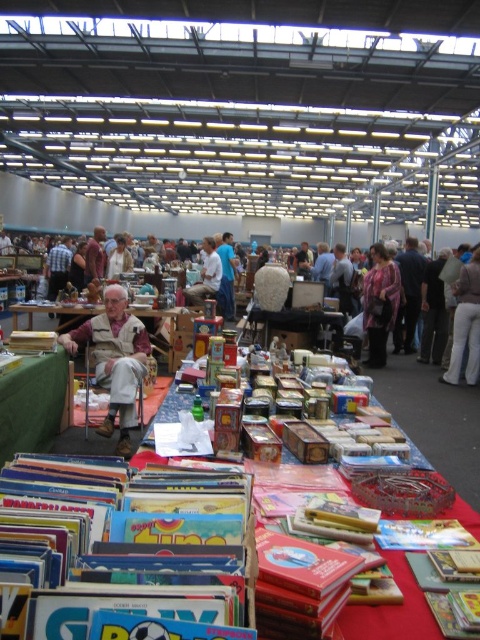
Is multicolored cardboard book at lower center to the right of patterned fabric jacket at center from the viewer's perspective?

In fact, multicolored cardboard book at lower center is to the left of patterned fabric jacket at center.

The image size is (480, 640). Identify the location of multicolored cardboard book at lower center. (127, 588).

Looking at this image, who is higher up, red fabric tablecloth at center or white cotton pants at right?

white cotton pants at right

Where is `red fabric tablecloth at center`? The image size is (480, 640). red fabric tablecloth at center is located at coordinates 435,419.

At what (x,y) coordinates should I click in order to perform the action: click on red fabric tablecloth at center. Please return your answer as a coordinate pair (x, y). This screenshot has width=480, height=640. Looking at the image, I should click on pos(435,419).

Does green fabric table at center appear on the right side of white fabric shirt at center?

No, green fabric table at center is not to the right of white fabric shirt at center.

Is point (180, 356) closer to camera compared to point (216, 289)?

Yes, point (180, 356) is in front of point (216, 289).

Identify the location of green fabric table at center. (169, 330).

Find the location of a particular element. green fabric table at center is located at coordinates (169, 330).